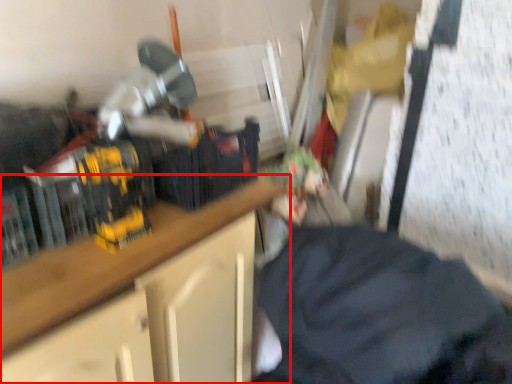
Question: From the image's perspective, what is the correct spatial positioning of cabinetry (annotated by the red box) in reference to clothing?

Choices:
 (A) below
 (B) above

Answer: (A)